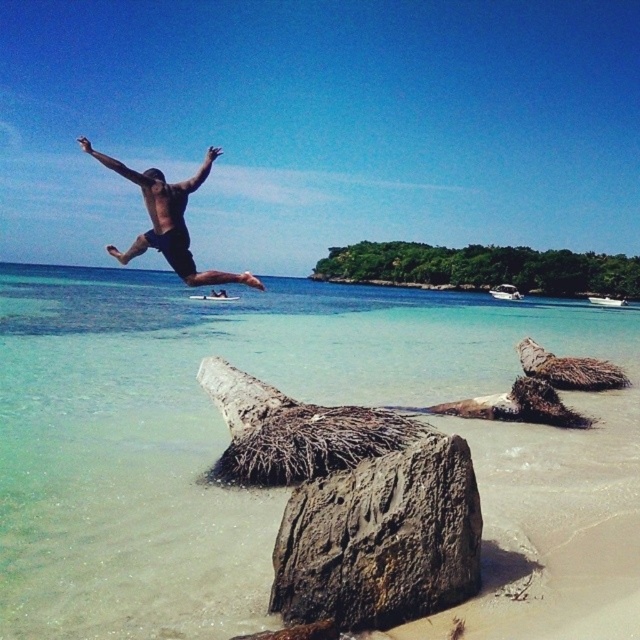
Based on the photo, you are a photographer trying to capture the best angle of the beach scene. You notice two points of interest marked as point (88, 460) and point (188, 262). Which point is closer to your camera position?

Point (88, 460) is closer to the camera than point (188, 262).

You are standing on the beach and want to place a small seashell on the clear sand at lower center. However, there is a rusty metallic rock at lower center in the way. Which object should you move to make space for the seashell?

The rusty metallic rock at lower center is further away from the viewer than the clear sand at lower center. To make space for the seashell, you should move the rusty metallic rock at lower center since it is not blocking the closer clear sand at lower center.